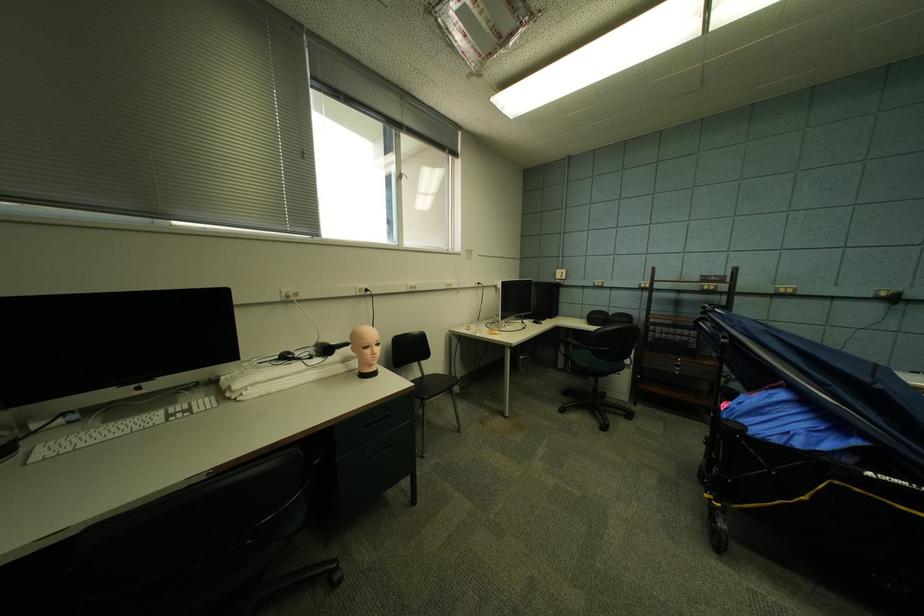
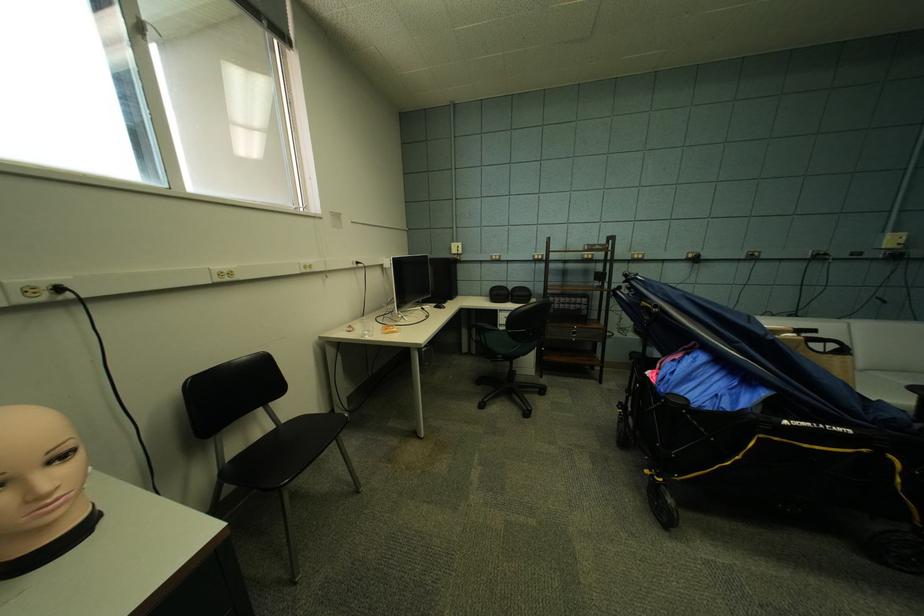
In the second image, find the point that corresponds to pixel 434 376 in the first image.

(292, 424)